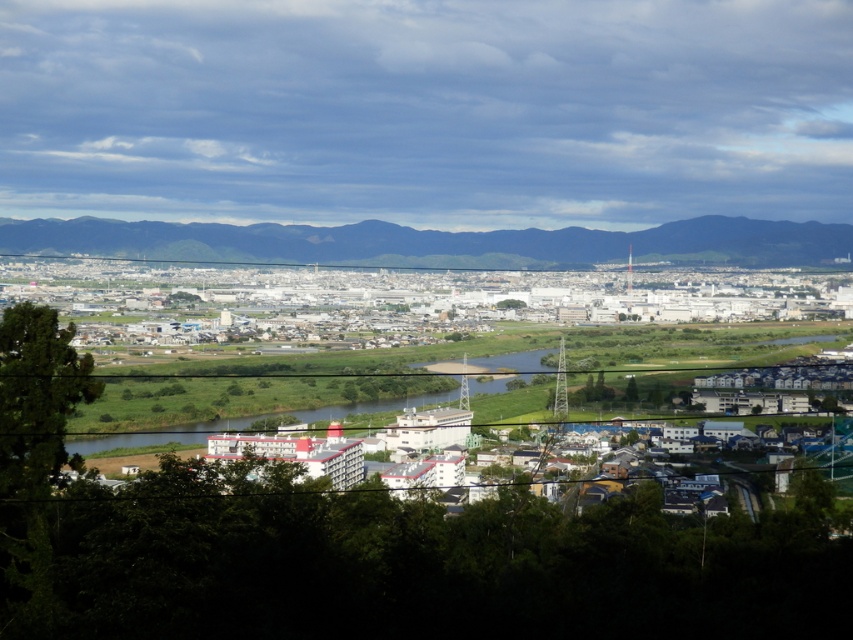
You are a drone operator trying to capture a photo of the white industrial buildings at center and the green grassy river at center. From your current position, can you see both objects simultaneously in your camera frame?

The white industrial buildings at center is located above green grassy river at center, so yes, you can see both objects simultaneously in your camera frame since they are vertically aligned.